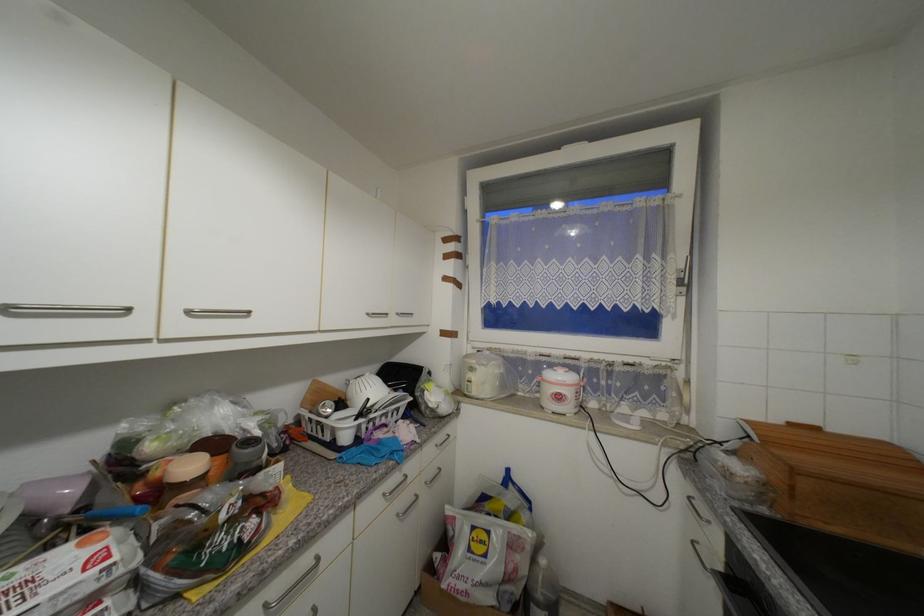
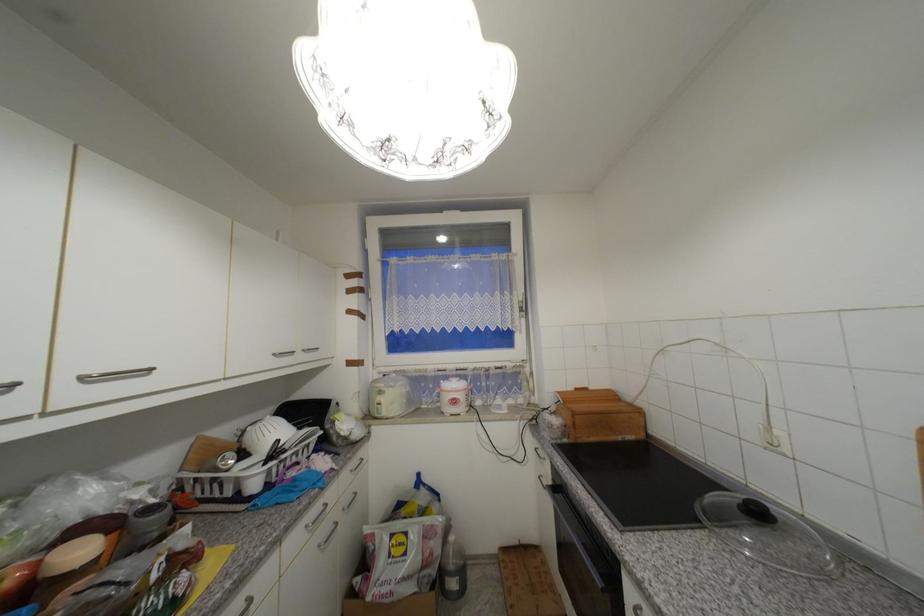
In the second image, find the point that corresponds to [373,315] in the first image.

(281, 355)